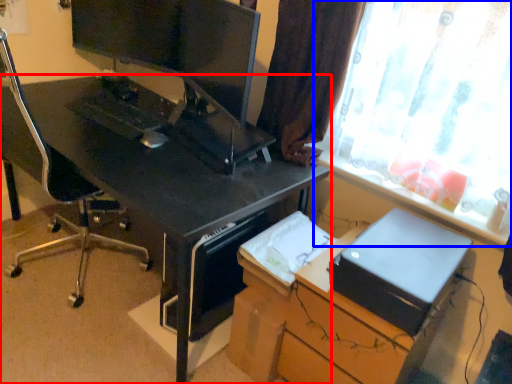
Question: Among these objects, which one is nearest to the camera, desk (highlighted by a red box) or window (highlighted by a blue box)?

Choices:
 (A) desk
 (B) window

Answer: (B)